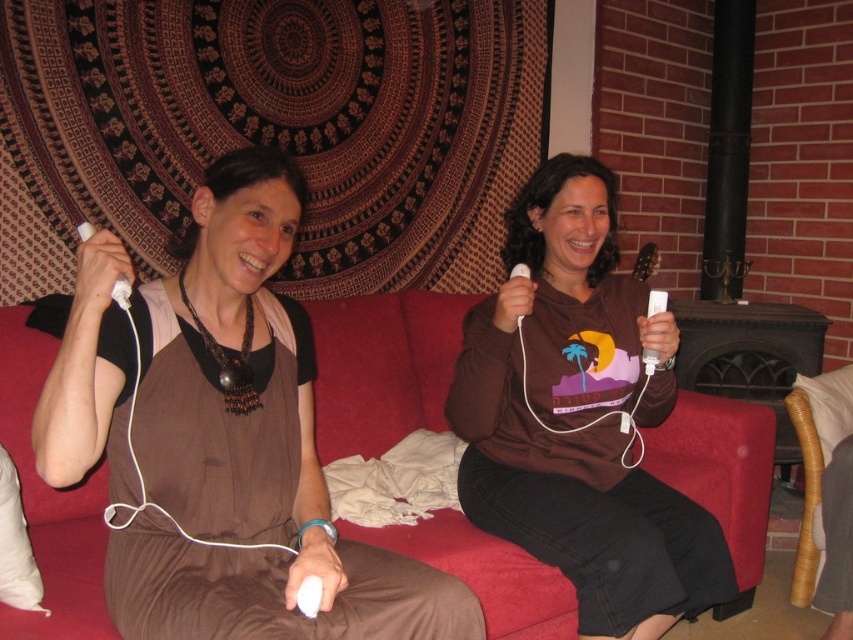
You are a photographer wanting to capture a candid shot of the two people sitting on the sofa. The camera you have can focus on subjects within a 5 feet range. Will both the brown fabric dress at center and the other person be in focus?

The two people are 5.10 feet apart, so the camera with a 5 feet focus range cannot capture both the brown fabric dress at center and the other person in focus simultaneously.

You are a photographer setting up a shoot in the scene. You need to position a light source to illuminate the white matte remote at left without casting a shadow on the brown matte shirt at center. Is this possible given their positions?

The white matte remote at left is behind the brown matte shirt at center, so positioning a light source in front of the shirt would illuminate the remote indirectly while avoiding casting a shadow on the shirt.

Please use the coordinates provided to determine the exact location of the brown fabric dress at center in the image. What are its coordinates?

The brown fabric dress at center is located at coordinates point (256, 336).